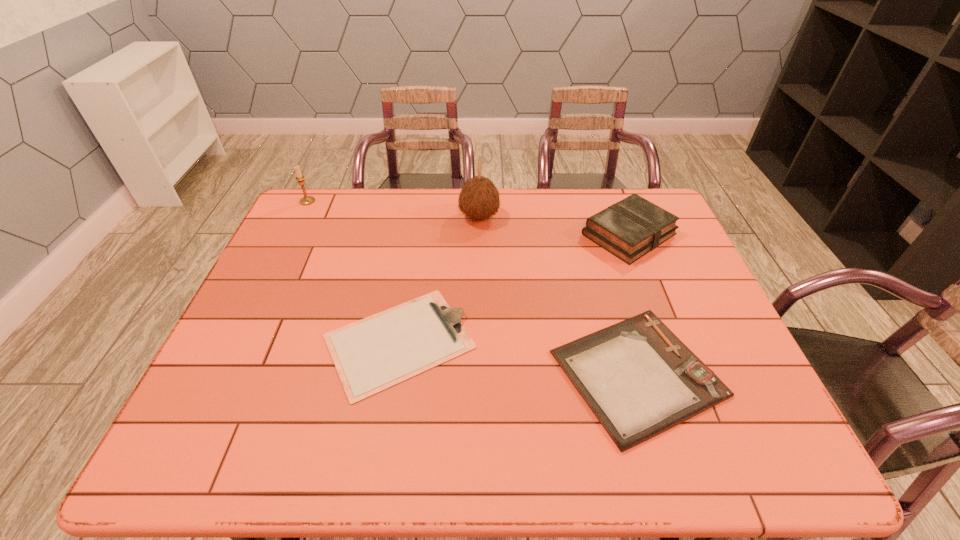
Locate an element on the screen. This screenshot has width=960, height=540. coconut is located at coordinates (479, 198).

Where is `the second tallest object`? the second tallest object is located at coordinates (306, 200).

At what (x,y) coordinates should I click in order to perform the action: click on the leftmost object. Please return your answer as a coordinate pair (x, y). The width and height of the screenshot is (960, 540). Looking at the image, I should click on (306, 200).

The height and width of the screenshot is (540, 960). In order to click on the third shortest object in this screenshot , I will do `click(629, 229)`.

Locate an element on the screen. Image resolution: width=960 pixels, height=540 pixels. the left clipboard is located at coordinates (373, 354).

Image resolution: width=960 pixels, height=540 pixels. I want to click on the right clipboard, so (639, 379).

This screenshot has height=540, width=960. In order to click on free space located 0.250m on the surface of the tallest object in this screenshot , I will do `click(576, 217)`.

This screenshot has width=960, height=540. Identify the location of vacant space located on the front of the leftmost object. (289, 239).

The height and width of the screenshot is (540, 960). What are the coordinates of `vacant space located 0.090m on the back of the book` in the screenshot? It's located at (612, 192).

Locate an element on the screen. free space located 0.060m on the left of the left clipboard is located at coordinates (298, 341).